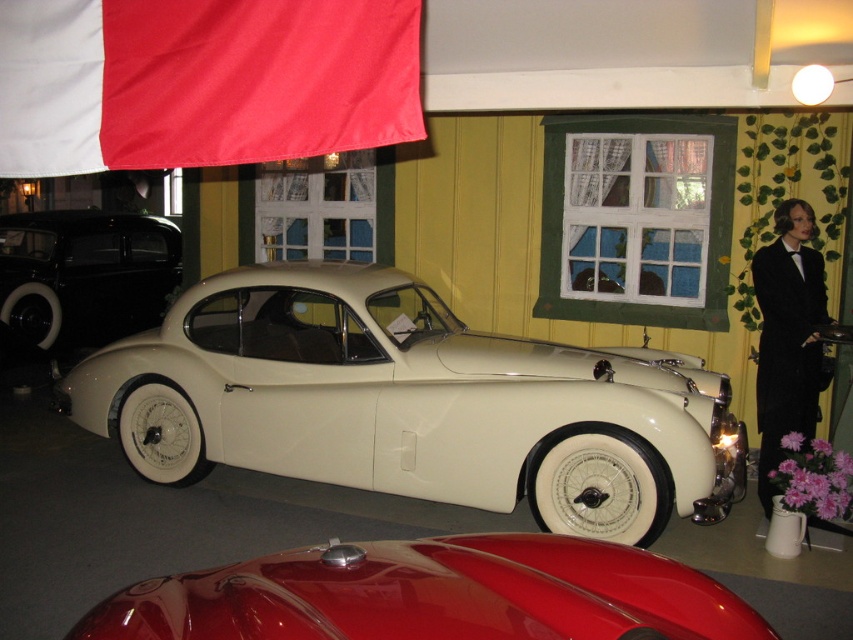
You are standing at the entrance of the vintage car exhibition hall. You want to take a photo of the cream matte car at center from a position that is exactly 2 meters away from it. Given that the car is located at coordinates point 0.631, 0.483, can you determine the coordinates where you should stand to be 2 meters away from the car?

The cream matte car at center is located at point (410, 403). To be exactly 2 meters away from it, you would need to stand at coordinates that are 2 meters away from this point. However, without knowing the scale of the coordinate system, it is impossible to determine the exact coordinates. The question requires knowing the scale of the coordinate system to calculate the precise location.

You are at a vintage car exhibition and see two cars in the center of the image. The cream matte car at center and the glossy red car at center. Which one is more to the left?

The cream matte car at center is more to the left side of the glossy red car at center.